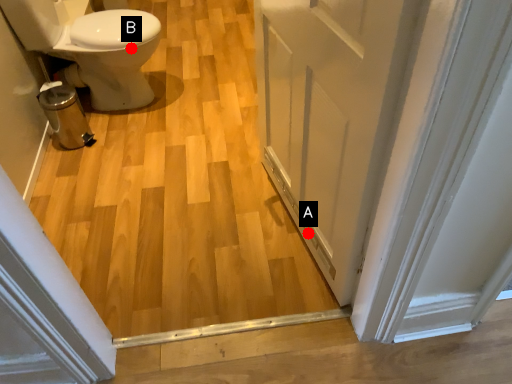
Question: Two points are circled on the image, labeled by A and B beside each circle. Which point is closer to the camera taking this photo?

Choices:
 (A) A is closer
 (B) B is closer

Answer: (A)